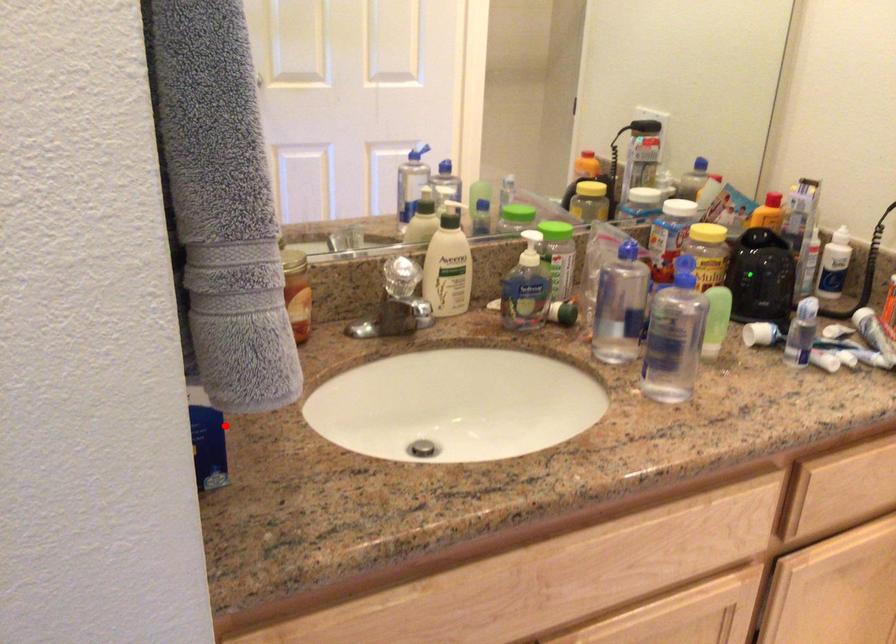
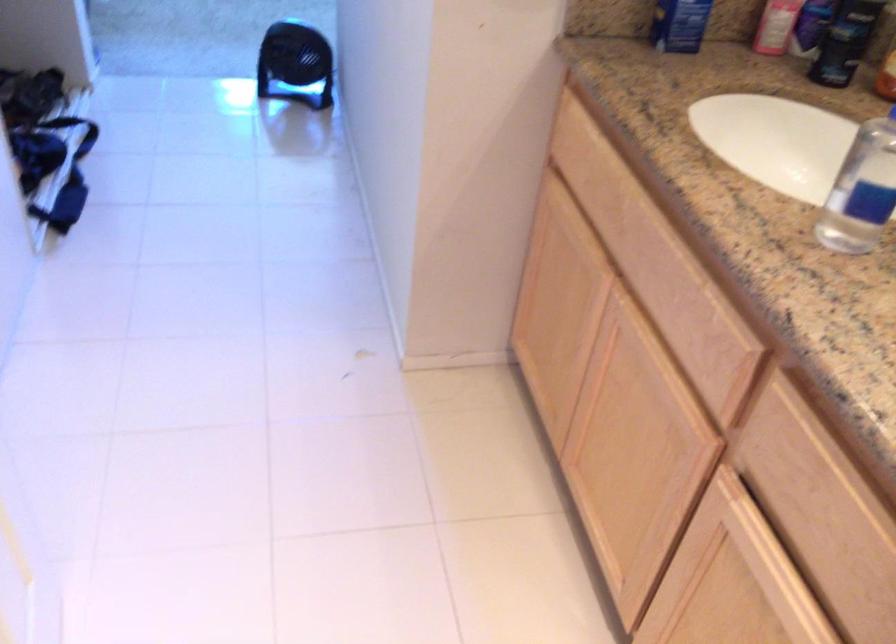
Locate, in the second image, the point that corresponds to the highlighted location in the first image.

(679, 24)